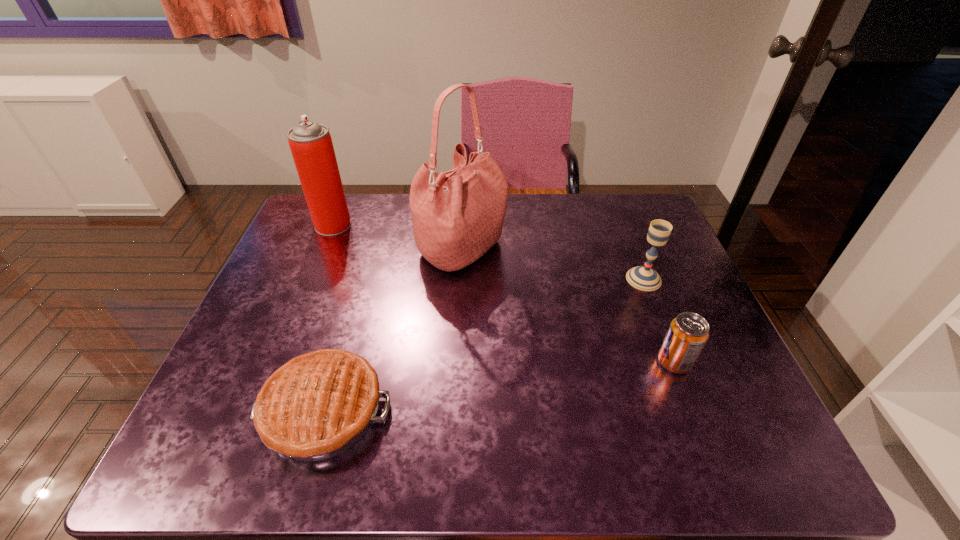
This screenshot has width=960, height=540. In order to click on vacant space located on the right of the shortest object in this screenshot , I will do `click(500, 411)`.

This screenshot has height=540, width=960. What are the coordinates of `handbag positioned at the far edge` in the screenshot? It's located at (458, 215).

Locate an element on the screen. The height and width of the screenshot is (540, 960). aerosol can that is at the far edge is located at coordinates (311, 145).

I want to click on object that is at the near edge, so click(x=317, y=405).

I want to click on aerosol can that is at the left edge, so click(311, 145).

Locate an element on the screen. The image size is (960, 540). pie that is at the left edge is located at coordinates click(x=317, y=405).

Where is `chalice located in the right edge section of the desktop`? This screenshot has width=960, height=540. chalice located in the right edge section of the desktop is located at coordinates [x=645, y=278].

The height and width of the screenshot is (540, 960). In order to click on soda can that is at the right edge in this screenshot , I will do `click(688, 333)`.

Image resolution: width=960 pixels, height=540 pixels. In order to click on object present at the far left corner in this screenshot , I will do `click(311, 145)`.

Locate an element on the screen. object present at the near left corner is located at coordinates (317, 405).